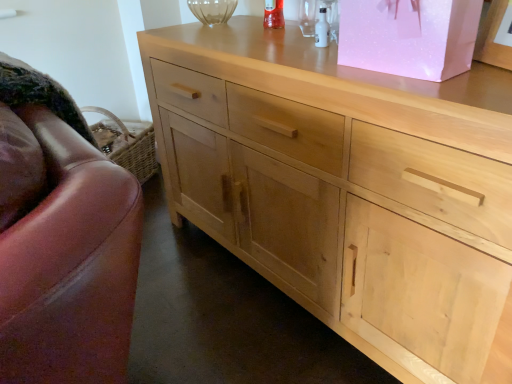
Question: Is natural wood cabinet at center bigger or smaller than leather swivel chair at left?

Choices:
 (A) small
 (B) big

Answer: (B)

Question: Is natural wood cabinet at center in front of or behind leather swivel chair at left in the image?

Choices:
 (A) front
 (B) behind

Answer: (A)

Question: Estimate the real-world distances between objects in this image. Which object is farther from the leather swivel chair at left?

Choices:
 (A) natural wood cabinet at center
 (B) pink paper bag at upper right

Answer: (B)

Question: Considering the real-world distances, which object is farthest from the leather swivel chair at left?

Choices:
 (A) natural wood cabinet at center
 (B) pink paper bag at upper right

Answer: (B)